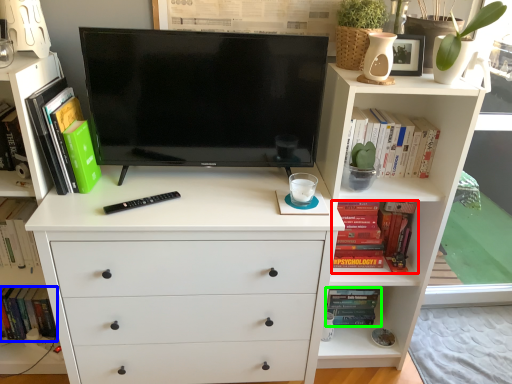
Question: Based on their relative distances, which object is nearer to book (highlighted by a red box)? Choose from book (highlighted by a blue box) and book (highlighted by a green box).

Choices:
 (A) book
 (B) book

Answer: (B)